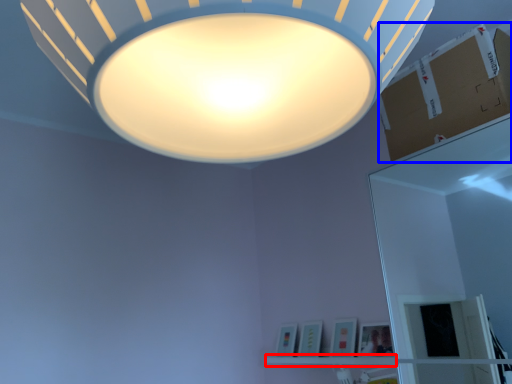
Question: Among these objects, which one is farthest to the camera, shelf (highlighted by a red box) or cardboard box (highlighted by a blue box)?

Choices:
 (A) shelf
 (B) cardboard box

Answer: (A)